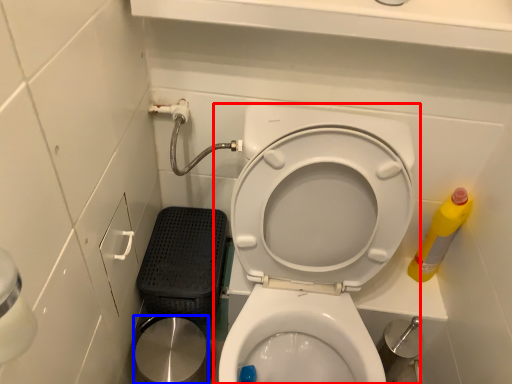
Question: Which object appears closest to the camera in this image, toilet (highlighted by a red box) or potty (highlighted by a blue box)?

Choices:
 (A) toilet
 (B) potty

Answer: (A)